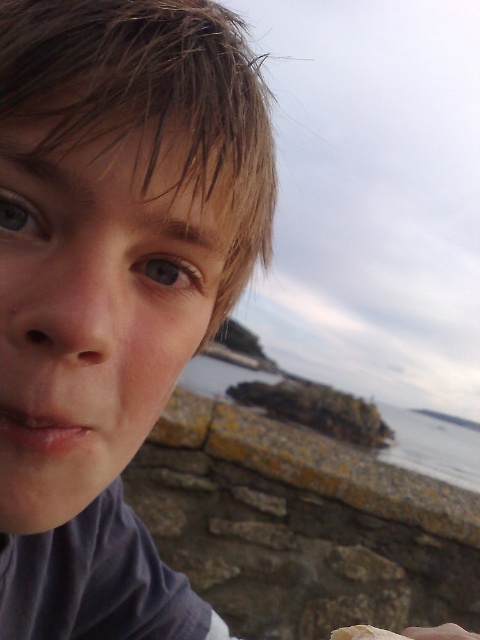
Question: Which object is farther from the camera taking this photo?

Choices:
 (A) clear water at lower right
 (B) smooth skin hand at lower right
 (C) matte gray hair at upper left

Answer: (A)

Question: Does matte gray hair at upper left appear under smooth skin hand at lower right?

Choices:
 (A) no
 (B) yes

Answer: (A)

Question: Does clear water at lower right appear over smooth skin hand at lower right?

Choices:
 (A) no
 (B) yes

Answer: (A)

Question: Considering the real-world distances, which object is closest to the clear water at lower right?

Choices:
 (A) smooth skin hand at lower right
 (B) matte gray hair at upper left

Answer: (B)

Question: In this image, where is matte gray hair at upper left located relative to clear water at lower right?

Choices:
 (A) left
 (B) right

Answer: (A)

Question: Which point is farther to the camera?

Choices:
 (A) (265, 371)
 (B) (160, 38)
 (C) (443, 634)

Answer: (A)